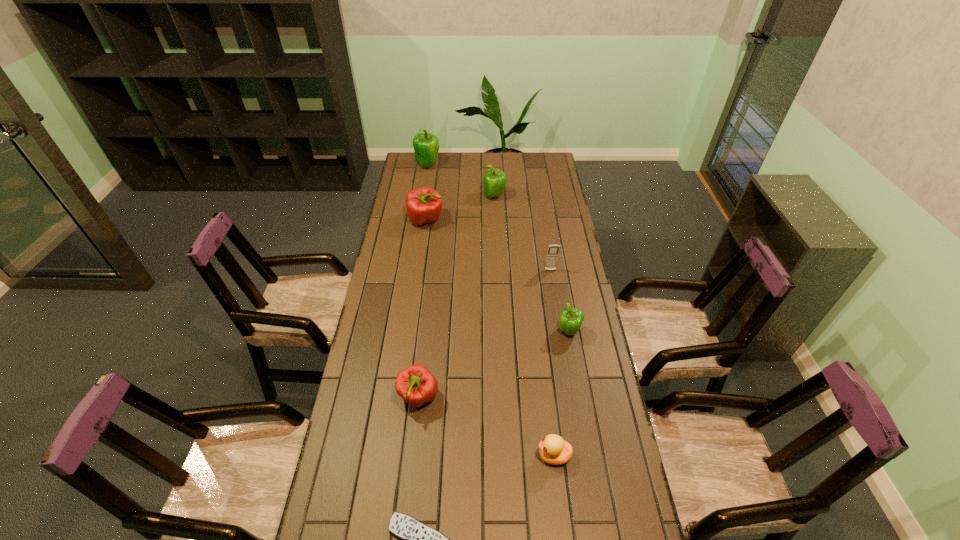
The image size is (960, 540). I want to click on vacant point located 0.070m on the face of the yellow duckling, so click(512, 456).

At what (x,y) coordinates should I click in order to perform the action: click on vacant space situated 0.350m on the face of the yellow duckling. Please return your answer as a coordinate pair (x, y). The image size is (960, 540). Looking at the image, I should click on (413, 456).

This screenshot has height=540, width=960. Identify the location of free space located on the face of the yellow duckling. (417, 456).

Where is `object located in the far edge section of the desktop`? The image size is (960, 540). object located in the far edge section of the desktop is located at coordinates (426, 145).

Find the location of a particular element. The height and width of the screenshot is (540, 960). cellular telephone positioned at the right edge is located at coordinates (551, 260).

The height and width of the screenshot is (540, 960). Identify the location of bell pepper situated at the right edge. (571, 318).

You are a GUI agent. You are given a task and a screenshot of the screen. Output one action in this format:
    pyautogui.click(x=<x>, y=<y>)
    Task: Click on the duckling present at the right edge
    The image size is (960, 540).
    Given the screenshot: What is the action you would take?
    pyautogui.click(x=553, y=450)

Locate an element on the screen. object present at the far left corner is located at coordinates (426, 145).

The image size is (960, 540). I want to click on vacant space at the far edge of the desktop, so click(x=514, y=175).

Where is `vacant space at the left edge`? This screenshot has width=960, height=540. vacant space at the left edge is located at coordinates (395, 217).